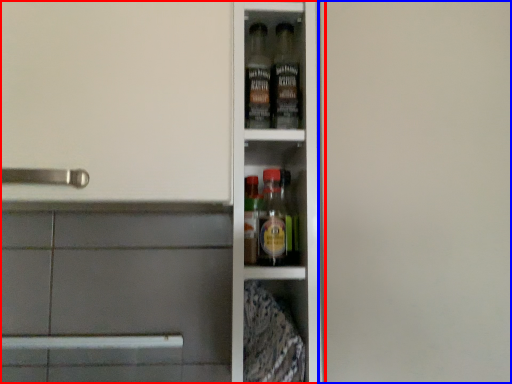
Question: Which object appears closest to the camera in this image, shelf (highlighted by a red box) or screen door (highlighted by a blue box)?

Choices:
 (A) shelf
 (B) screen door

Answer: (B)